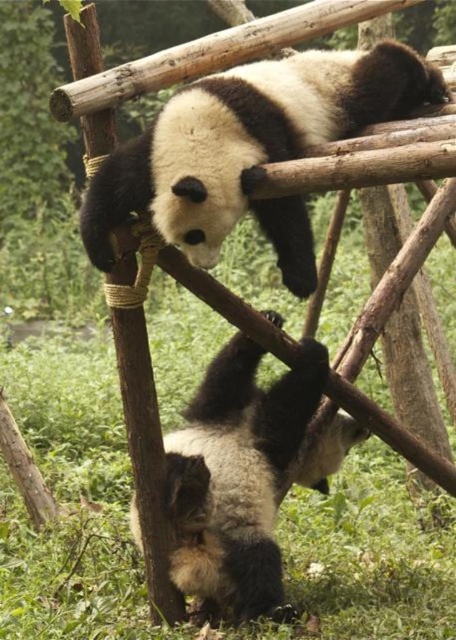
Is black fuzzy panda at upper center above soft fur panda at lower center?

Yes.

Who is more distant from viewer, (291,284) or (271,595)?

Point (271,595)

Where is `black fuzzy panda at upper center`? black fuzzy panda at upper center is located at coordinates (249, 148).